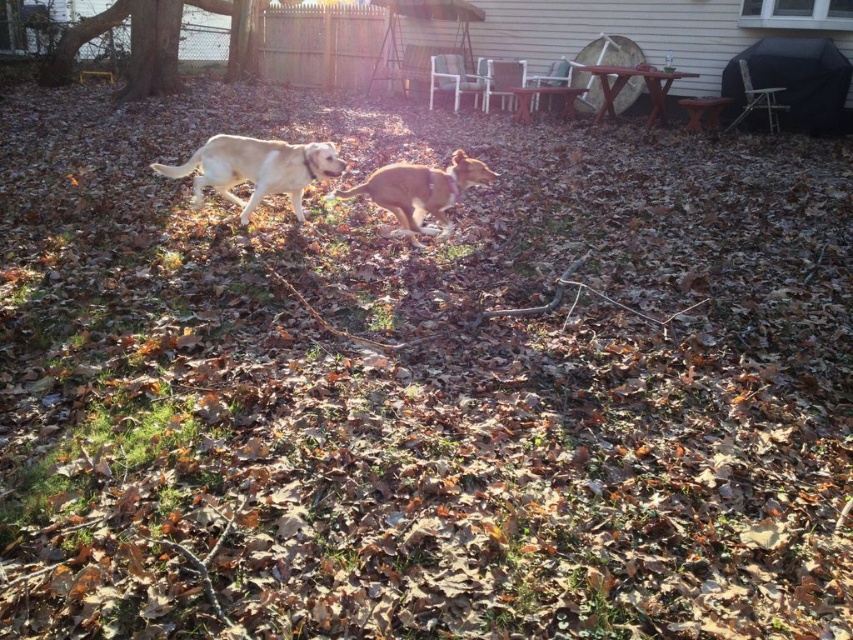
Question: Among these points, which one is nearest to the camera?

Choices:
 (A) (286, 179)
 (B) (456, 157)

Answer: (B)

Question: Which of the following is the farthest from the observer?

Choices:
 (A) golden brown fur at center
 (B) golden fur dog at center

Answer: (B)

Question: Can you confirm if golden fur dog at center is smaller than golden brown fur at center?

Choices:
 (A) yes
 (B) no

Answer: (B)

Question: Is golden fur dog at center closer to camera compared to golden brown fur at center?

Choices:
 (A) yes
 (B) no

Answer: (B)

Question: Which point appears farthest from the camera in this image?

Choices:
 (A) (277, 186)
 (B) (378, 196)

Answer: (A)

Question: Is golden fur dog at center thinner than golden brown fur at center?

Choices:
 (A) yes
 (B) no

Answer: (B)